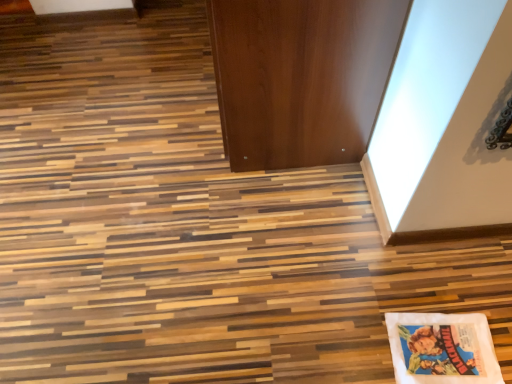
Locate an element on the screen. The height and width of the screenshot is (384, 512). free space above white paper comic book at lower right (from a real-world perspective) is located at coordinates (436, 342).